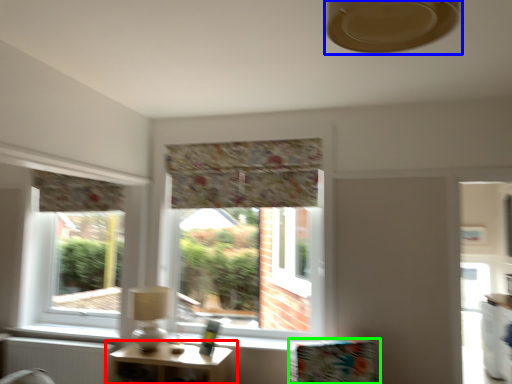
Question: Which object is positioned closest to table (highlighted by a red box)? Select from fan (highlighted by a blue box) and furniture (highlighted by a green box).

Choices:
 (A) fan
 (B) furniture

Answer: (B)